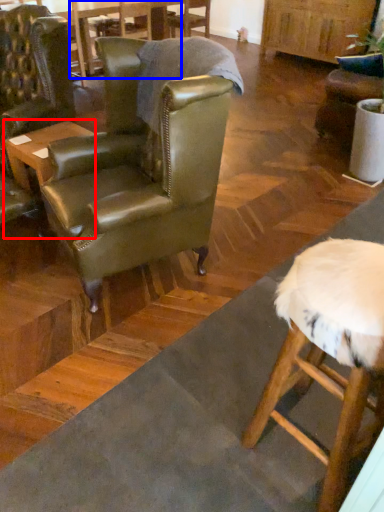
Question: Which of the following is the closest to the observer, table (highlighted by a red box) or table (highlighted by a blue box)?

Choices:
 (A) table
 (B) table

Answer: (A)